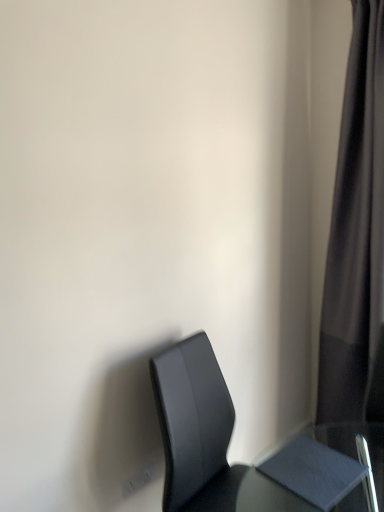
Question: Is matte gray table at lower right in front of or behind black fabric curtain at right in the image?

Choices:
 (A) behind
 (B) front

Answer: (B)

Question: In terms of size, does matte gray table at lower right appear bigger or smaller than black fabric curtain at right?

Choices:
 (A) big
 (B) small

Answer: (B)

Question: Which of these objects is positioned farthest from the black fabric curtain at right?

Choices:
 (A) matte gray table at lower right
 (B) matte black chair at lower right

Answer: (B)

Question: Which is farther from the matte black chair at lower right?

Choices:
 (A) black fabric curtain at right
 (B) matte gray table at lower right

Answer: (A)